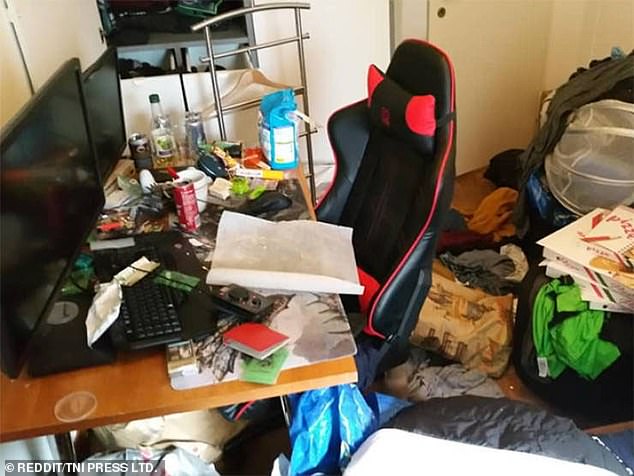
You are a GUI agent. You are given a task and a screenshot of the screen. Output one action in this format:
    pyautogui.click(x=<x>, y=<y>)
    Task: Click on the door
    
    Given the screenshot: What is the action you would take?
    pyautogui.click(x=489, y=36)